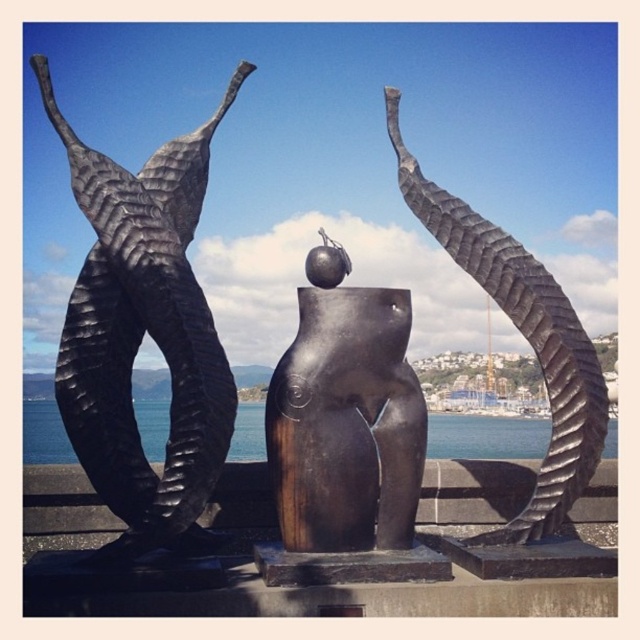
Question: Observing the image, what is the correct spatial positioning of polished bronze sculpture at center in reference to blue water at center?

Choices:
 (A) right
 (B) left

Answer: (A)

Question: Estimate the real-world distances between objects in this image. Which object is farther from the bronze matte torso at center?

Choices:
 (A) blue water at center
 (B) matte black sculpture at left
 (C) polished bronze sculpture at center

Answer: (A)

Question: Which point is closer to the camera?

Choices:
 (A) bronze matte torso at center
 (B) blue water at center
 (C) polished bronze sculpture at center
 (D) matte black sculpture at left

Answer: (D)

Question: Considering the relative positions of polished bronze sculpture at center and blue water at center in the image provided, where is polished bronze sculpture at center located with respect to blue water at center?

Choices:
 (A) above
 (B) below

Answer: (A)

Question: Does matte black sculpture at left appear on the left side of blue water at center?

Choices:
 (A) no
 (B) yes

Answer: (B)

Question: Which object is positioned closest to the matte black sculpture at left?

Choices:
 (A) bronze matte torso at center
 (B) blue water at center
 (C) polished bronze sculpture at center

Answer: (A)